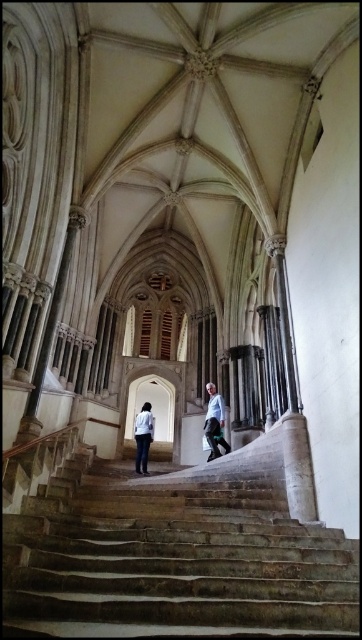
You are standing at the bottom of the grand staircase in the historic building. You notice a specific point marked at coordinates (175, 554). Based on the scene description, what object is located at that point?

The point at coordinates (175, 554) indicates the location of the stone stairs at center.

You are standing at the bottom of the staircase in the grand historic building. You see the green fabric pants at center and a camera somewhere in the scene. Which object is closer to you?

The green fabric pants at center is closer to you because the camera is 65.20 meters away from it, meaning the camera is farther away from you than the green fabric pants at center.

You are an interior designer assessing the space in the grand historic building. You notice the green fabric pants at center and the light blue shirt at center. Which of these two items takes up more visual space in the scene?

The light blue shirt at center takes up more visual space than the green fabric pants at center.